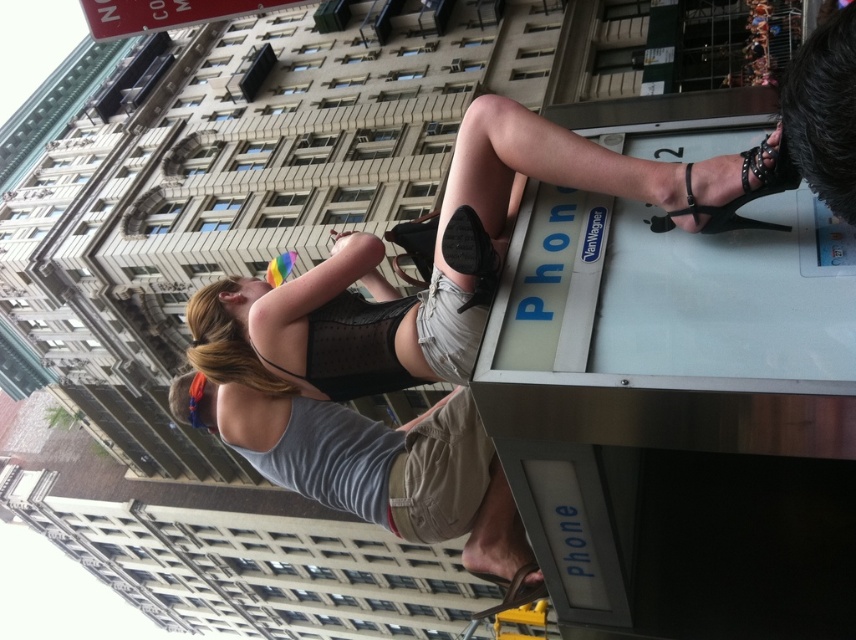
You are a fashion designer observing the urban scene and notice the black leather sandal at upper right and the brown leather sandal at lower center. Which sandal would you recommend to a client who prefers a more petite size?

The black leather sandal at upper right is smaller than the brown leather sandal at lower center, so it would be the better recommendation for a client seeking a petite size.

You are a photographer trying to capture both the black leather sandal at upper right and the brown leather sandal at lower center in a single shot. Which sandal should you focus on first to ensure both are in focus?

You should focus on the brown leather sandal at lower center first because it is farther from the viewer than the black leather sandal at upper right, ensuring both will be in focus when focusing on the farther object.